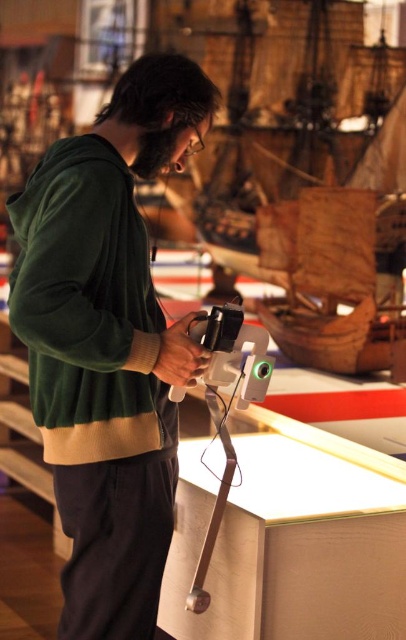
Question: Which of these objects is positioned closest to the green velvety sweatshirt at left?

Choices:
 (A) green soft sweater at center
 (B) matte black video camera at center

Answer: (A)

Question: Can you confirm if green soft sweater at center is bigger than green velvety sweatshirt at left?

Choices:
 (A) no
 (B) yes

Answer: (B)

Question: Does green velvety sweatshirt at left appear over matte black video camera at center?

Choices:
 (A) no
 (B) yes

Answer: (B)

Question: Which point is farther from the camera taking this photo?

Choices:
 (A) (222, 324)
 (B) (27, 346)

Answer: (B)

Question: Is green soft sweater at center thinner than green velvety sweatshirt at left?

Choices:
 (A) yes
 (B) no

Answer: (B)

Question: Among these objects, which one is farthest from the camera?

Choices:
 (A) green velvety sweatshirt at left
 (B) matte black video camera at center
 (C) green soft sweater at center

Answer: (B)